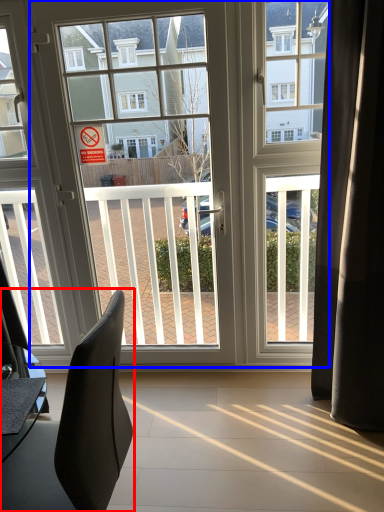
Question: Which object is further to the camera taking this photo, chair (highlighted by a red box) or door (highlighted by a blue box)?

Choices:
 (A) chair
 (B) door

Answer: (B)